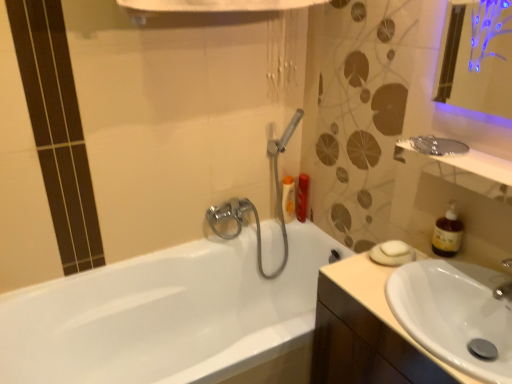
Identify the location of free point above beige wood cabinet at lower right (from a real-world perspective). (419, 282).